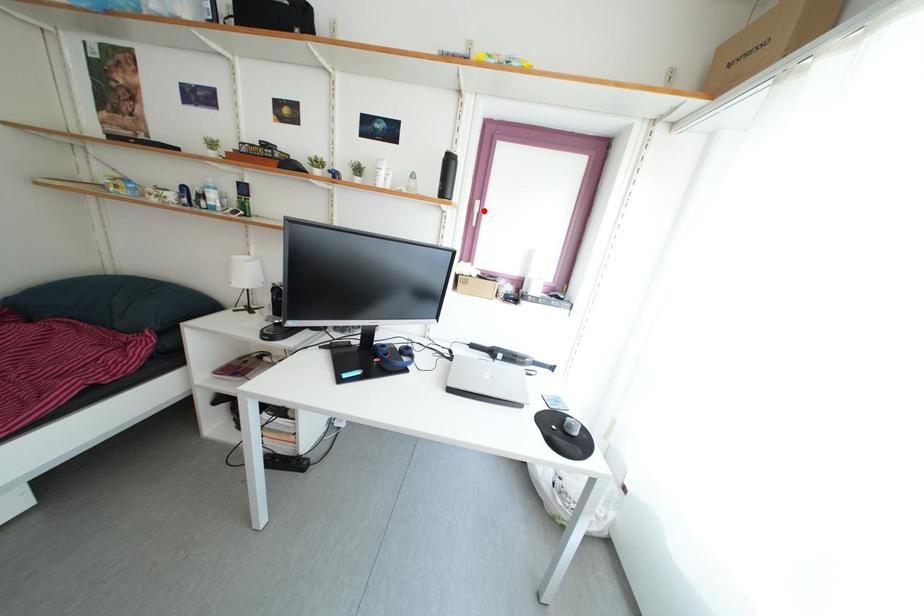
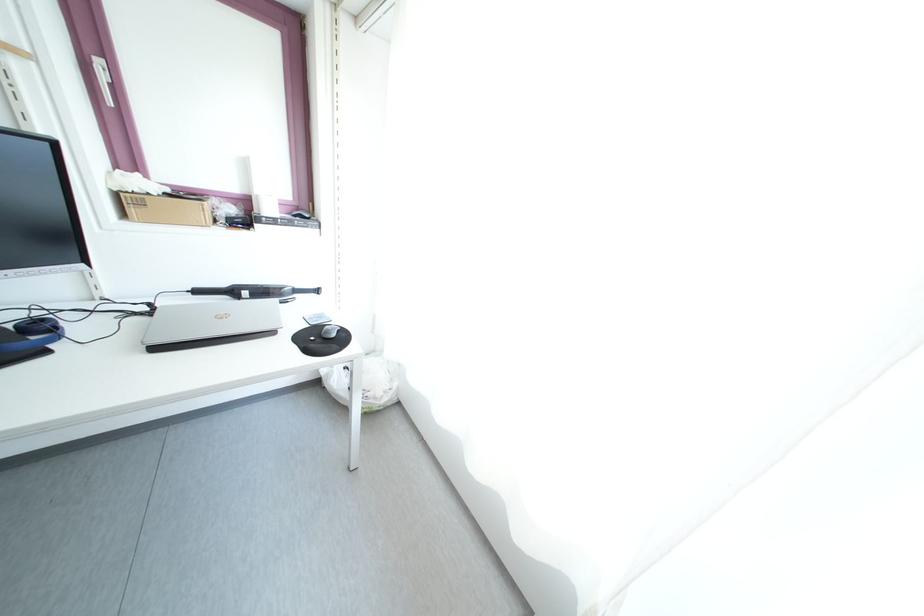
The point at the highlighted location is marked in the first image. Where is the corresponding point in the second image?

(105, 71)